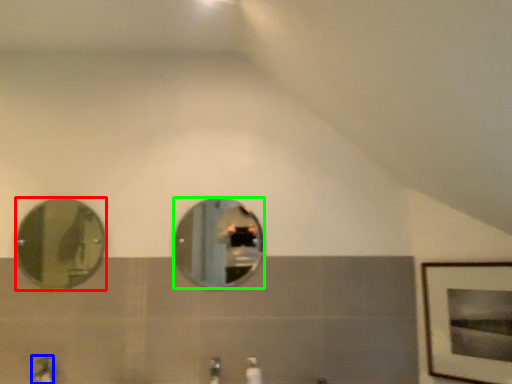
Question: Which object is the closest to the mirror (highlighted by a red box)? Choose among these: faucet (highlighted by a blue box) or mirror (highlighted by a green box).

Choices:
 (A) faucet
 (B) mirror

Answer: (B)